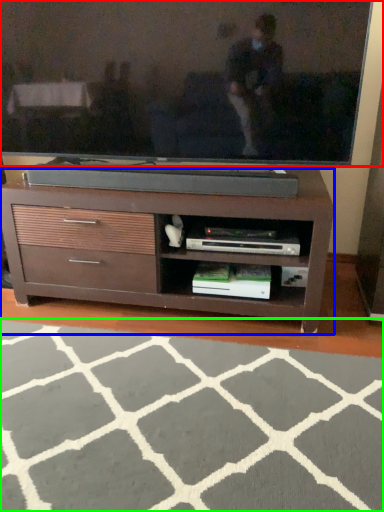
Question: Which object is the farthest from television (highlighted by a red box)? Choose among these: chest of drawers (highlighted by a blue box) or plain (highlighted by a green box).

Choices:
 (A) chest of drawers
 (B) plain

Answer: (B)